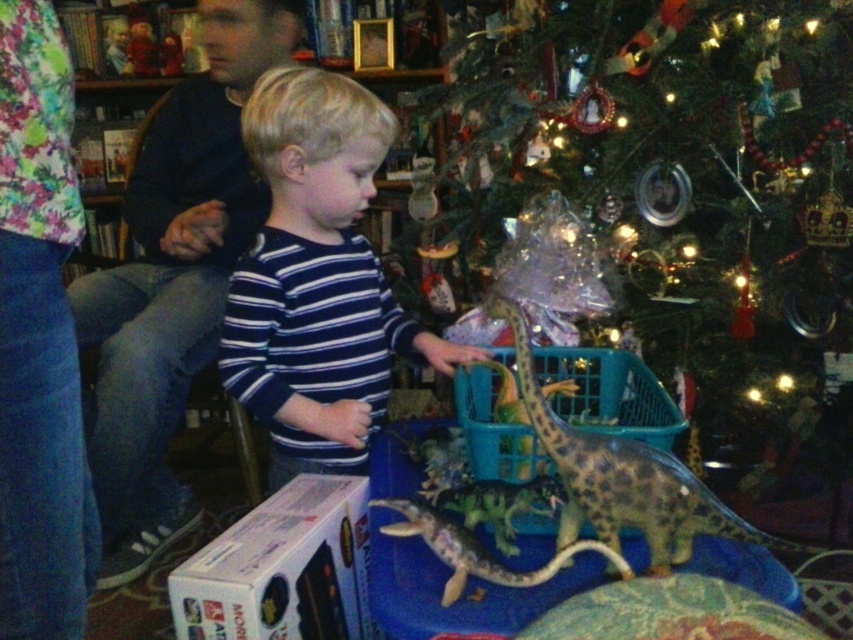
You are standing at the center of the room and want to place a new gift under the shiny green tree at center. To do so, you need to walk straight towards the tree. Which direction should you move from your current position?

Since you are already at the center of the room and the shiny green tree at center is located at point (677, 170), you should move towards the coordinates (677, 170) to reach the tree. However, since both you and the tree are at the center, you might need to check the exact location relative to your current standing point.

You are a photographer trying to capture the child and the spotted brown toy dinosaur at lower center. To ensure both are in frame, should you move your camera to the left or right of the blue striped shirt at center?

The blue striped shirt at center is to the left of the spotted brown toy dinosaur at lower center. To include both in the frame, move the camera to the right of the blue striped shirt at center so that the spotted brown toy dinosaur at lower center remains visible.